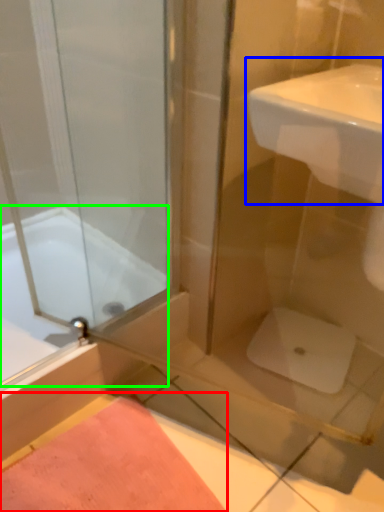
Question: Considering the real-world distances, which object is farthest from bath mat (highlighted by a red box)? sink (highlighted by a blue box) or bathtub (highlighted by a green box)?

Choices:
 (A) sink
 (B) bathtub

Answer: (A)